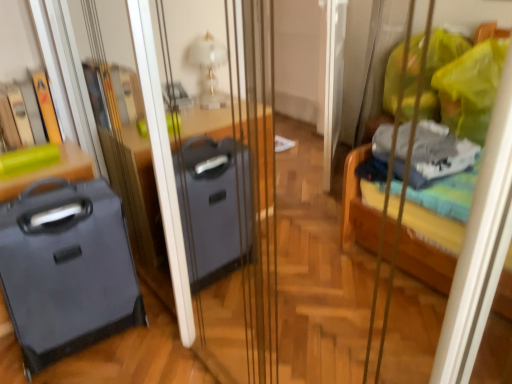
Where is `matte black suitcase at left`? The width and height of the screenshot is (512, 384). matte black suitcase at left is located at coordinates (67, 270).

The height and width of the screenshot is (384, 512). Describe the element at coordinates (67, 270) in the screenshot. I see `matte black suitcase at left` at that location.

What is the approximate height of green matte suitcase at left?

2.83 inches.

Describe the element at coordinates (52, 171) in the screenshot. The width and height of the screenshot is (512, 384). I see `green matte suitcase at left` at that location.

Where is `green matte suitcase at left`? The image size is (512, 384). green matte suitcase at left is located at coordinates (52, 171).

Measure the distance between point (74, 163) and camera.

A distance of 1.55 meters exists between point (74, 163) and camera.

Identify the location of matte black suitcase at left. This screenshot has height=384, width=512. (67, 270).

Is green matte suitcase at left at the left side of matte black suitcase at left?

Yes.

Which object is further away from the camera, green matte suitcase at left or matte black suitcase at left?

green matte suitcase at left is behind.

Is point (93, 172) closer to camera compared to point (74, 267)?

No, (93, 172) is further to viewer.

From the image's perspective, is green matte suitcase at left positioned above or below matte black suitcase at left?

Clearly, from the image's perspective, green matte suitcase at left is above matte black suitcase at left.

From a real-world perspective, which is physically below, green matte suitcase at left or matte black suitcase at left?

From a 3D spatial view, matte black suitcase at left is below.

Based on the photo, considering the sizes of objects green matte suitcase at left and matte black suitcase at left in the image provided, who is wider, green matte suitcase at left or matte black suitcase at left?

matte black suitcase at left is wider.

Between green matte suitcase at left and matte black suitcase at left, which one has more height?

With more height is matte black suitcase at left.

From the picture: Is green matte suitcase at left smaller than matte black suitcase at left?

Yes, green matte suitcase at left is smaller than matte black suitcase at left.

Is matte black suitcase at left inside green matte suitcase at left?

Actually, matte black suitcase at left is outside green matte suitcase at left.

Is green matte suitcase at left far from matte black suitcase at left?

Actually, green matte suitcase at left and matte black suitcase at left are a little close together.

Is matte black suitcase at left at the back of green matte suitcase at left?

No, green matte suitcase at left is not facing the opposite direction of matte black suitcase at left.

What's the angular difference between green matte suitcase at left and matte black suitcase at left's facing directions?

They differ by 10.2 degrees in their facing directions.

Locate an element on the screen. luggage lying in front of the green matte suitcase at left is located at coordinates (67, 270).

From the picture: Which object is positioned more to the right, matte black suitcase at left or green matte suitcase at left?

Positioned to the right is matte black suitcase at left.

Relative to green matte suitcase at left, is matte black suitcase at left in front or behind?

In the image, matte black suitcase at left appears in front of green matte suitcase at left.

Is point (78, 336) closer to viewer compared to point (57, 170)?

No, (78, 336) is behind (57, 170).

From the image's perspective, is matte black suitcase at left positioned above or below green matte suitcase at left?

Clearly, from the image's perspective, matte black suitcase at left is below green matte suitcase at left.

From a real-world perspective, who is located higher, matte black suitcase at left or green matte suitcase at left?

In real-world perspective, green matte suitcase at left is above.

Is matte black suitcase at left wider or thinner than green matte suitcase at left?

Considering their sizes, matte black suitcase at left looks broader than green matte suitcase at left.

Considering the sizes of matte black suitcase at left and green matte suitcase at left in the image, is matte black suitcase at left taller or shorter than green matte suitcase at left?

Clearly, matte black suitcase at left is taller compared to green matte suitcase at left.

Considering the sizes of objects matte black suitcase at left and green matte suitcase at left in the image provided, who is bigger, matte black suitcase at left or green matte suitcase at left?

matte black suitcase at left.

Would you say matte black suitcase at left contains green matte suitcase at left?

No, matte black suitcase at left does not contain green matte suitcase at left.

Would you consider matte black suitcase at left to be distant from green matte suitcase at left?

No, matte black suitcase at left is in close proximity to green matte suitcase at left.

Is matte black suitcase at left oriented towards green matte suitcase at left?

No, matte black suitcase at left is not aimed at green matte suitcase at left.

From the picture: How many degrees apart are the facing directions of matte black suitcase at left and green matte suitcase at left?

They differ by 10.2 degrees in their facing directions.

How far apart are matte black suitcase at left and green matte suitcase at left?

A distance of 11.80 inches exists between matte black suitcase at left and green matte suitcase at left.

Find the location of a particular element. The image size is (512, 384). furniture located above the matte black suitcase at left (from the image's perspective) is located at coordinates (52, 171).

The width and height of the screenshot is (512, 384). What are the coordinates of `luggage below the green matte suitcase at left (from the image's perspective)` in the screenshot? It's located at (67, 270).

Identify the location of luggage on the right of the green matte suitcase at left. 67,270.